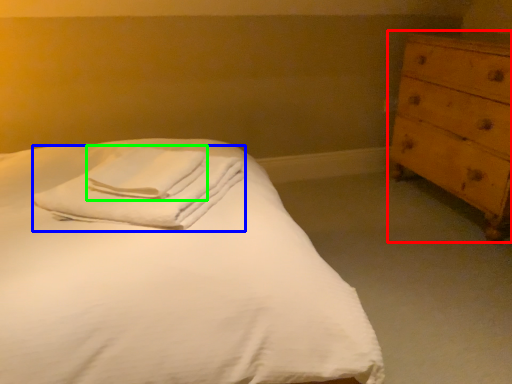
Question: Considering the real-world distances, which object is closest to chest of drawers (highlighted by a red box)? material (highlighted by a blue box) or bath towel (highlighted by a green box).

Choices:
 (A) material
 (B) bath towel

Answer: (A)